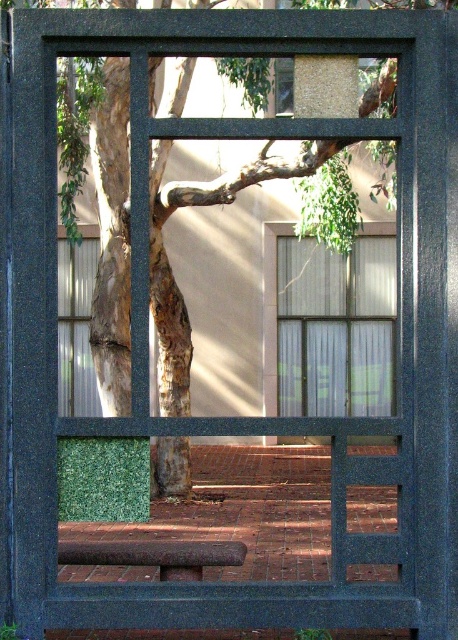
Does clear glass window at center have a lesser width compared to rustic wood bench at lower center?

No.

Who is taller, clear glass window at center or rustic wood bench at lower center?

clear glass window at center

Image resolution: width=458 pixels, height=640 pixels. What are the coordinates of `clear glass window at center` in the screenshot? It's located at (333, 324).